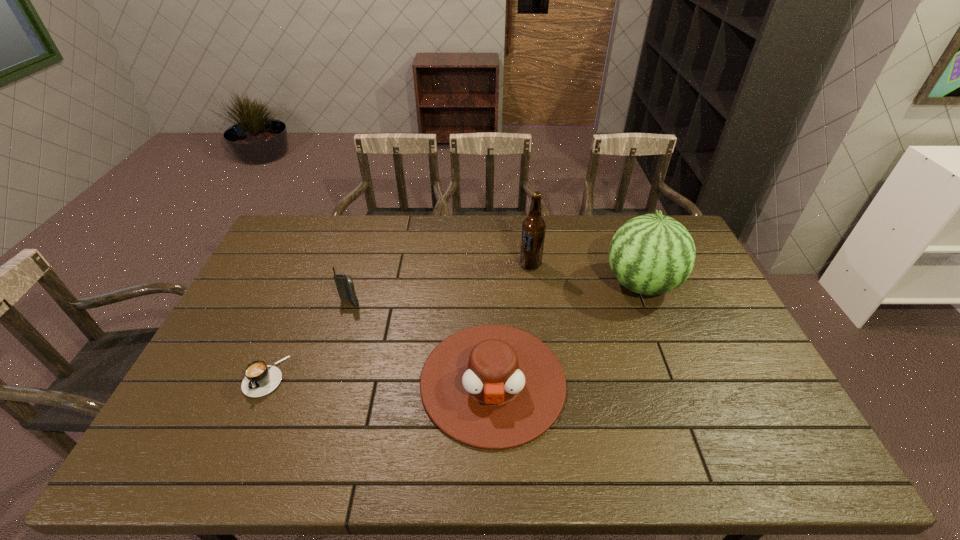
Identify the location of beer bottle. (533, 227).

Find the location of `watermelon`. watermelon is located at coordinates (652, 254).

Find the location of a particular element. The image size is (960, 540). cellular telephone is located at coordinates (345, 286).

Find the location of `the third shortest object`. the third shortest object is located at coordinates (345, 286).

The image size is (960, 540). I want to click on the fourth tallest object, so click(494, 387).

Where is `cappuccino`? cappuccino is located at coordinates (260, 379).

Identify the location of the leftmost object. The height and width of the screenshot is (540, 960). (260, 379).

Find the location of a particular element. The width and height of the screenshot is (960, 540). vacant space situated on the label of the beer bottle is located at coordinates (491, 265).

The height and width of the screenshot is (540, 960). What are the coordinates of `free space located 0.070m on the label of the beer bottle` in the screenshot? It's located at (499, 265).

Locate an element on the screen. vacant point located 0.340m on the label of the beer bottle is located at coordinates (421, 265).